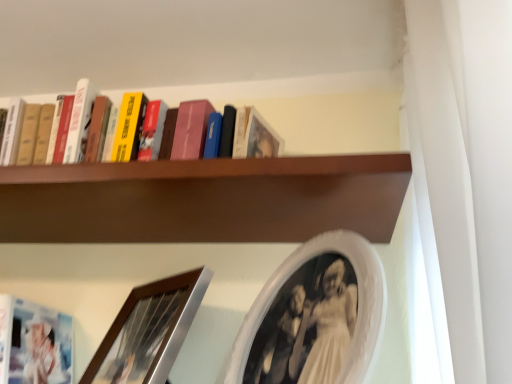
Question: From a real-world perspective, is brown wooden shelf at upper center beneath brushed silver picture frame at lower left, positioned as the first picture frame in left-to-right order?

Choices:
 (A) yes
 (B) no

Answer: (B)

Question: Does brown wooden shelf at upper center have a lesser height compared to brushed silver picture frame at lower left, positioned as the first picture frame in left-to-right order?

Choices:
 (A) no
 (B) yes

Answer: (B)

Question: Is brown wooden shelf at upper center to the left of brushed silver picture frame at lower left, positioned as the first picture frame in left-to-right order, from the viewer's perspective?

Choices:
 (A) yes
 (B) no

Answer: (B)

Question: Can you confirm if brown wooden shelf at upper center is bigger than brushed silver picture frame at lower left, which is the 2th picture frame in right-to-left order?

Choices:
 (A) yes
 (B) no

Answer: (A)

Question: From the image's perspective, would you say brown wooden shelf at upper center is shown under brushed silver picture frame at lower left, positioned as the first picture frame in left-to-right order?

Choices:
 (A) no
 (B) yes

Answer: (A)

Question: Does point (369, 158) appear closer or farther from the camera than point (261, 296)?

Choices:
 (A) closer
 (B) farther

Answer: (A)

Question: Based on their sizes in the image, would you say brown wooden shelf at upper center is bigger or smaller than white oval picture frame at upper center, which is counted as the first picture frame, starting from the right?

Choices:
 (A) big
 (B) small

Answer: (A)

Question: From the image's perspective, relative to white oval picture frame at upper center, which is counted as the first picture frame, starting from the right, is brown wooden shelf at upper center above or below?

Choices:
 (A) below
 (B) above

Answer: (B)

Question: In the image, is brown wooden shelf at upper center on the left side or the right side of white oval picture frame at upper center, which is the 2th picture frame in left-to-right order?

Choices:
 (A) left
 (B) right

Answer: (A)

Question: In the image, is brushed silver picture frame at lower left, positioned as the first picture frame in left-to-right order, positioned in front of or behind brown wooden shelf at upper center?

Choices:
 (A) front
 (B) behind

Answer: (A)

Question: From their relative heights in the image, would you say brushed silver picture frame at lower left, which is the 2th picture frame in right-to-left order, is taller or shorter than brown wooden shelf at upper center?

Choices:
 (A) tall
 (B) short

Answer: (A)

Question: Considering the positions of brushed silver picture frame at lower left, which is the 2th picture frame in right-to-left order, and brown wooden shelf at upper center in the image, is brushed silver picture frame at lower left, which is the 2th picture frame in right-to-left order, bigger or smaller than brown wooden shelf at upper center?

Choices:
 (A) small
 (B) big

Answer: (A)

Question: Is point (121, 354) closer or farther from the camera than point (181, 188)?

Choices:
 (A) closer
 (B) farther

Answer: (B)

Question: Is brown wooden shelf at upper center inside the boundaries of brushed silver picture frame at lower left, which is the 2th picture frame in right-to-left order, or outside?

Choices:
 (A) outside
 (B) inside

Answer: (A)

Question: In terms of size, does brown wooden shelf at upper center appear bigger or smaller than brushed silver picture frame at lower left, which is the 2th picture frame in right-to-left order?

Choices:
 (A) small
 (B) big

Answer: (B)